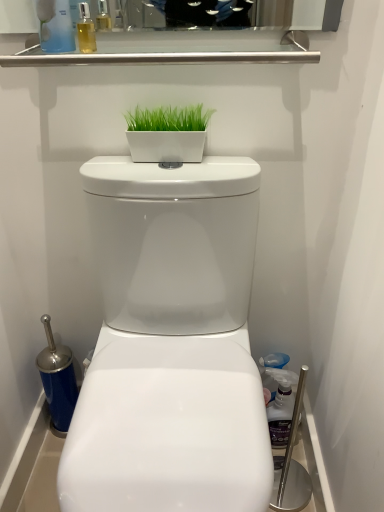
This screenshot has height=512, width=384. Identify the location of vacant space situated on the left part of green matte planter at center. (119, 165).